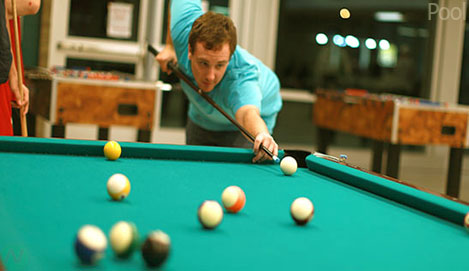
Where is `doors`? Image resolution: width=469 pixels, height=271 pixels. doors is located at coordinates (95, 22), (165, 23).